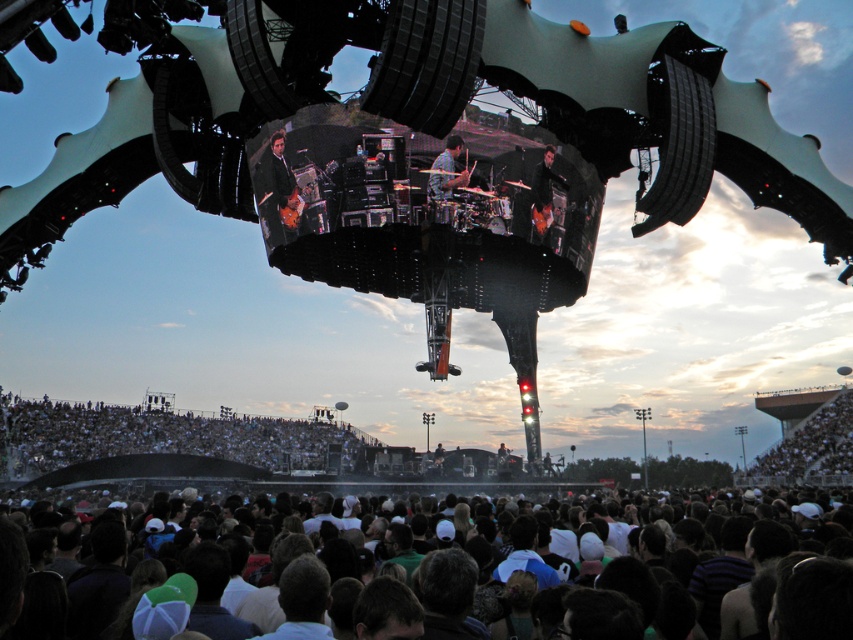
Question: Is shiny black guitar at center bigger than smooth skin drumsticks at center?

Choices:
 (A) yes
 (B) no

Answer: (A)

Question: Which point is farther to the camera?

Choices:
 (A) (447, 189)
 (B) (287, 168)

Answer: (B)

Question: Among these points, which one is nearest to the camera?

Choices:
 (A) (436, 196)
 (B) (274, 218)
 (C) (148, 419)

Answer: (A)

Question: Among these objects, which one is nearest to the camera?

Choices:
 (A) smooth skin drumsticks at center
 (B) white fabric crowd at lower center
 (C) shiny black guitar at center

Answer: (A)

Question: Does white fabric crowd at lower center have a lesser width compared to shiny black guitar at center?

Choices:
 (A) no
 (B) yes

Answer: (A)

Question: Can you confirm if shiny black guitar at center is positioned to the left of smooth skin drumsticks at center?

Choices:
 (A) yes
 (B) no

Answer: (A)